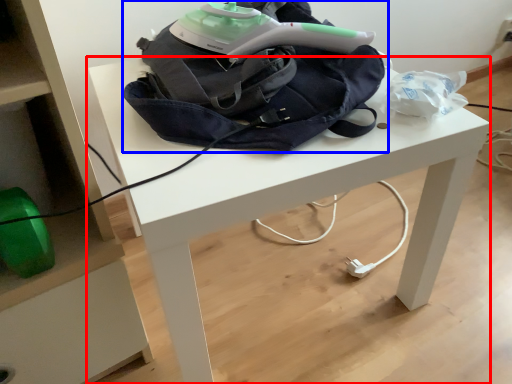
Question: Which object appears farthest to the camera in this image, table (highlighted by a red box) or bag (highlighted by a blue box)?

Choices:
 (A) table
 (B) bag

Answer: (B)